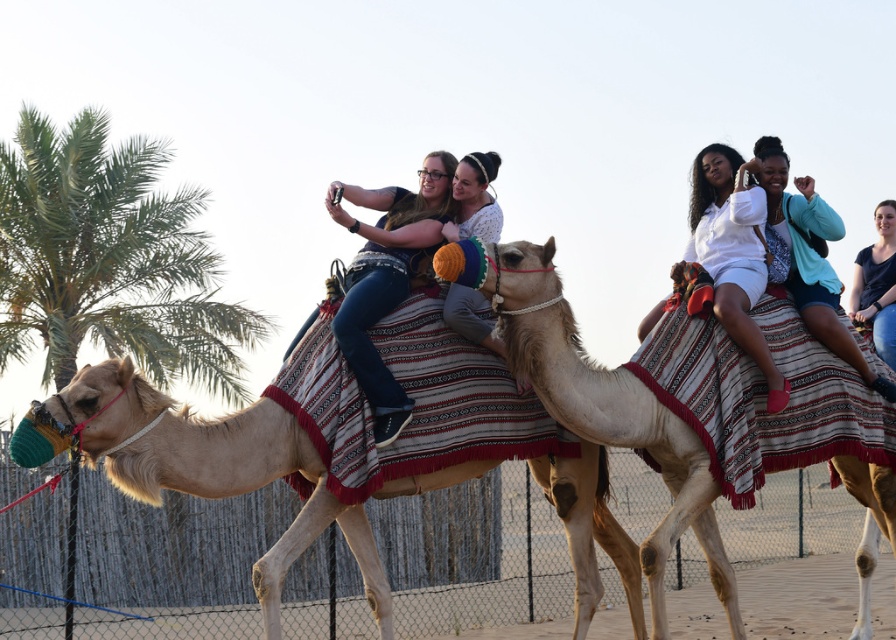
Is light beige fabric camel at center behind white cotton shirt at upper right?

No, light beige fabric camel at center is in front of white cotton shirt at upper right.

This screenshot has width=896, height=640. Describe the element at coordinates (608, 413) in the screenshot. I see `light beige fabric camel at center` at that location.

You are a GUI agent. You are given a task and a screenshot of the screen. Output one action in this format:
    pyautogui.click(x=<x>, y=<y>)
    Task: Click on the light beige fabric camel at center
    The width and height of the screenshot is (896, 640).
    Given the screenshot: What is the action you would take?
    pyautogui.click(x=608, y=413)

Does green leafy palm tree at left appear on the right side of light beige camel at center?

Incorrect, green leafy palm tree at left is not on the right side of light beige camel at center.

I want to click on green leafy palm tree at left, so click(109, 259).

Which is in front, point (28, 115) or point (573, 525)?

Point (573, 525)

You are a GUI agent. You are given a task and a screenshot of the screen. Output one action in this format:
    pyautogui.click(x=<x>, y=<y>)
    Task: Click on the green leafy palm tree at left
    
    Given the screenshot: What is the action you would take?
    pyautogui.click(x=109, y=259)

Image resolution: width=896 pixels, height=640 pixels. Find the location of `light beige fabric camel at center`. light beige fabric camel at center is located at coordinates (608, 413).